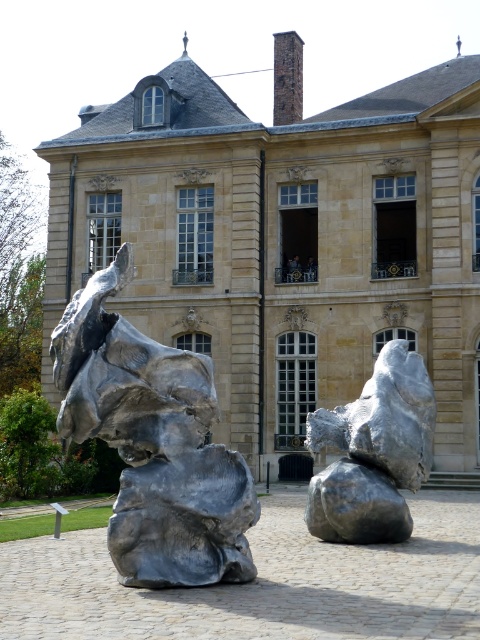
At what (x,y) coordinates should I click in order to perform the action: click on brushed metal sculpture at center. Please return your answer as a coordinate pair (x, y). This screenshot has height=640, width=480. Looking at the image, I should click on (154, 444).

Does brushed metal sculpture at center have a smaller size compared to shiny metallic rock at center?

No, brushed metal sculpture at center is not smaller than shiny metallic rock at center.

Is point (160, 380) less distant than point (368, 476)?

That is True.

Locate an element on the screen. This screenshot has width=480, height=640. brushed metal sculpture at center is located at coordinates (154, 444).

Who is higher up, matte stone sculpture at center or brushed metal sculpture at center?

matte stone sculpture at center is above.

Which of these two, matte stone sculpture at center or brushed metal sculpture at center, stands shorter?

With less height is brushed metal sculpture at center.

Between point (429, 116) and point (122, 326), which one is positioned in front?

Point (122, 326) is more forward.

Identify the location of matte stone sculpture at center. (286, 241).

Can you confirm if brushed metal rock at center is bigger than shiny metallic rock at center?

Indeed, brushed metal rock at center has a larger size compared to shiny metallic rock at center.

Where is `brushed metal rock at center`? The height and width of the screenshot is (640, 480). brushed metal rock at center is located at coordinates (373, 452).

Where is `brushed metal rock at center`? The width and height of the screenshot is (480, 640). brushed metal rock at center is located at coordinates coord(373,452).

You are a GUI agent. You are given a task and a screenshot of the screen. Output one action in this format:
    pyautogui.click(x=<x>, y=<y>)
    Task: Click on the brushed metal rock at center
    
    Given the screenshot: What is the action you would take?
    pyautogui.click(x=373, y=452)